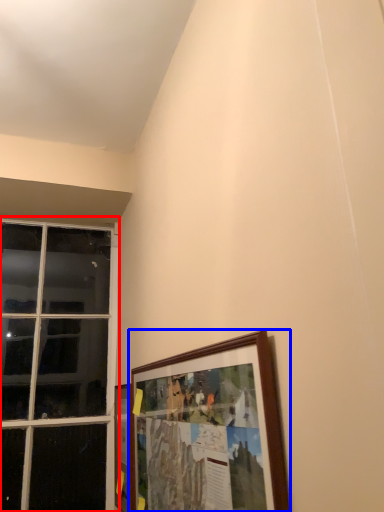
Question: Which of the following is the closest to the observer, window (highlighted by a red box) or picture frame (highlighted by a blue box)?

Choices:
 (A) window
 (B) picture frame

Answer: (B)